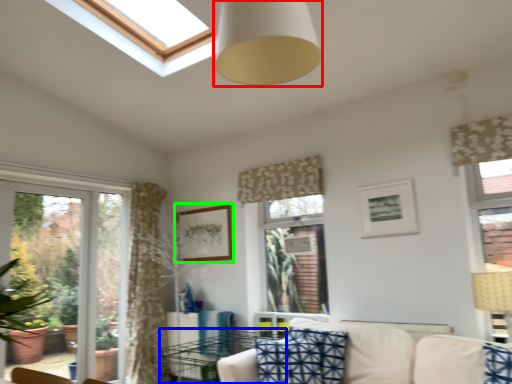
Question: Based on their relative distances, which object is nearer to fixture (highlighted by a red box)? Choose from table (highlighted by a blue box) and picture frame (highlighted by a green box).

Choices:
 (A) table
 (B) picture frame

Answer: (B)